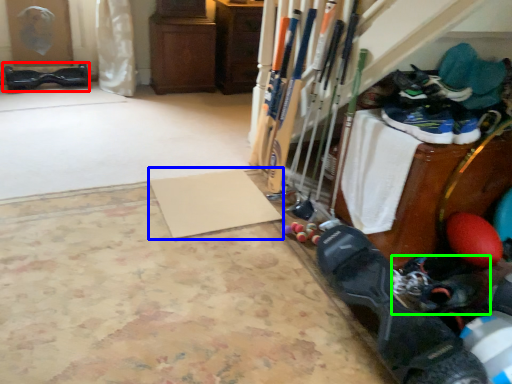
Question: Based on their relative distances, which object is farther from footwear (highlighted by a red box)? Choose from yoga mat (highlighted by a blue box) and footwear (highlighted by a green box).

Choices:
 (A) yoga mat
 (B) footwear

Answer: (B)